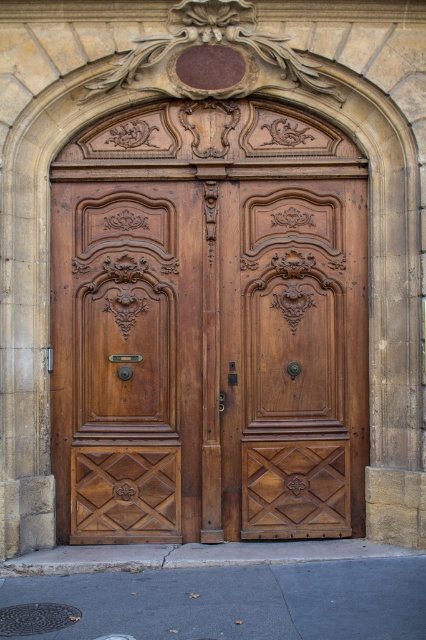
Between polished wood door at center and matte wood door at center, which one is positioned lower?

polished wood door at center is below.

Is polished wood door at center thinner than matte wood door at center?

In fact, polished wood door at center might be wider than matte wood door at center.

This screenshot has height=640, width=426. What are the coordinates of `polished wood door at center` in the screenshot? It's located at (126, 358).